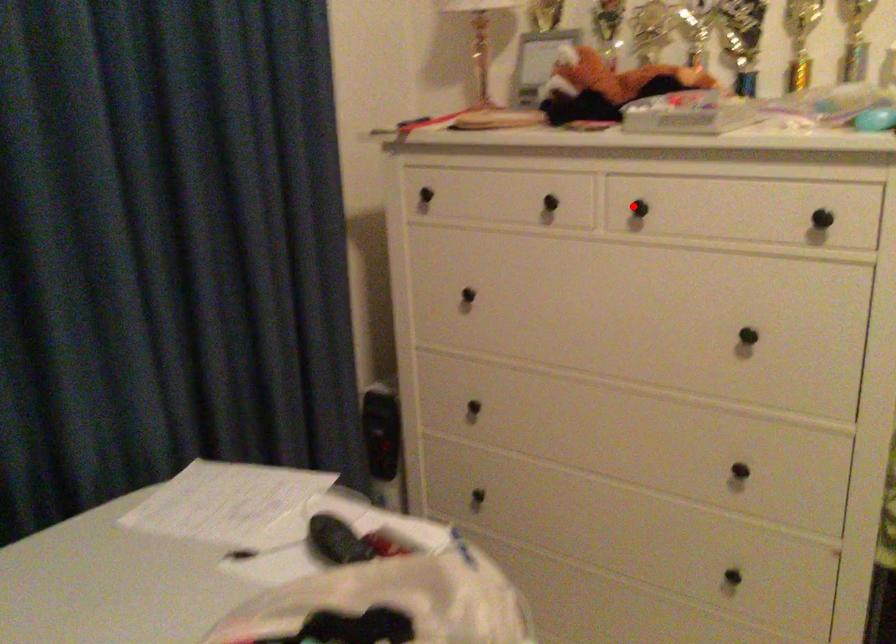
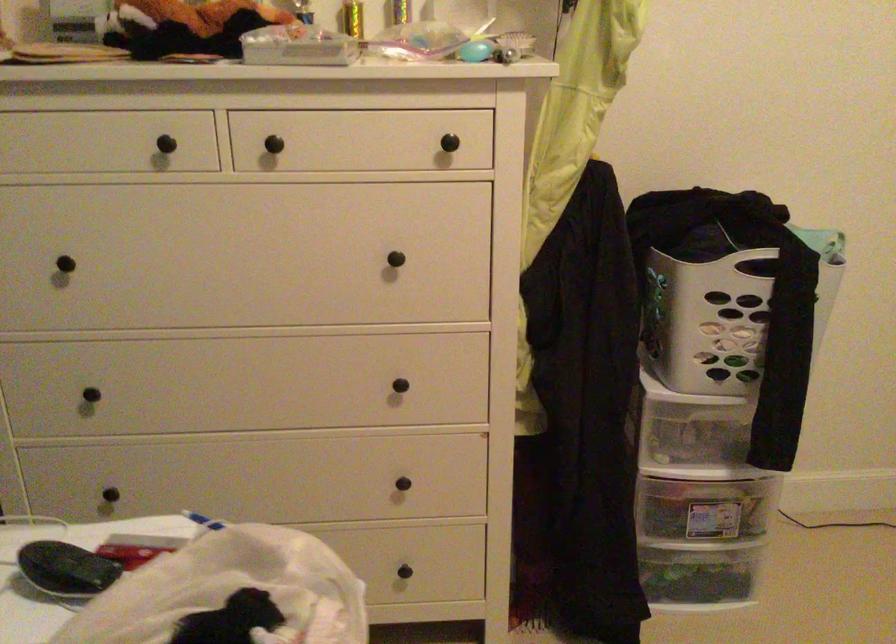
The point at the highlighted location is marked in the first image. Where is the corresponding point in the second image?

(261, 140)